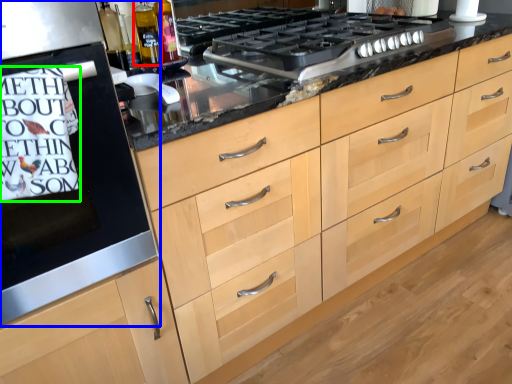
Question: Considering the real-world distances, which object is farthest from bottle (highlighted by a red box)? home appliance (highlighted by a blue box) or writing (highlighted by a green box)?

Choices:
 (A) home appliance
 (B) writing

Answer: (B)